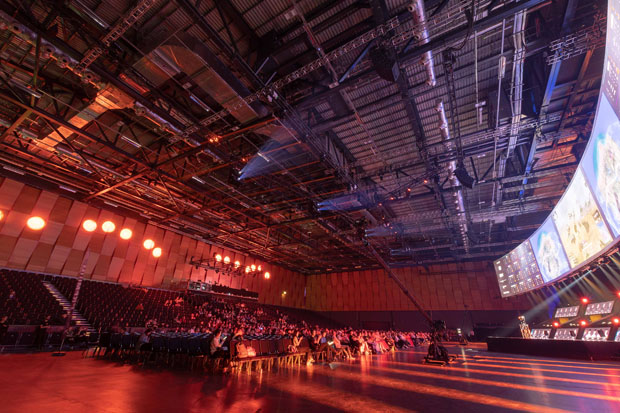
The image size is (620, 413). What are the coordinates of `screen` in the screenshot? It's located at (508, 273), (547, 260), (589, 232), (601, 181), (613, 49).